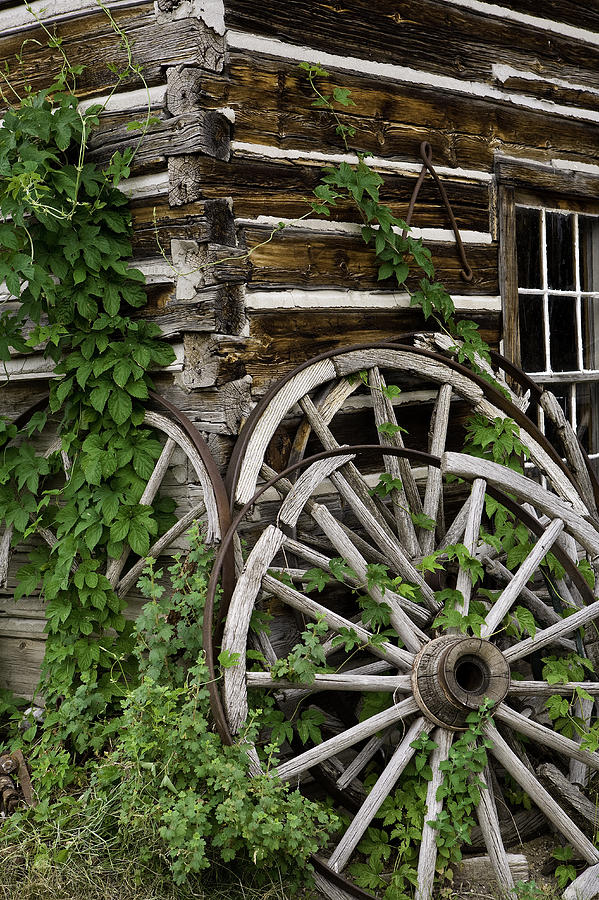
What are the coordinates of `window frame` in the screenshot? It's located at (544, 178).